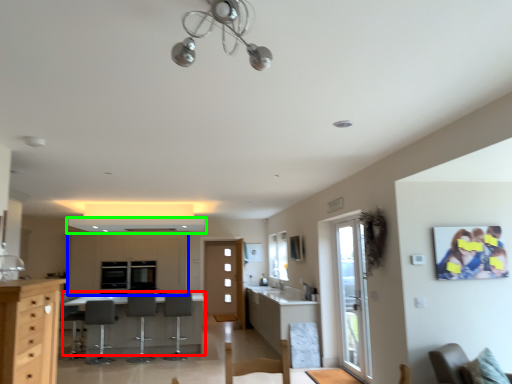
Question: Which object is the closest to the table (highlighted by a red box)? Choose among these: cabinetry (highlighted by a blue box) or exhaust hood (highlighted by a green box).

Choices:
 (A) cabinetry
 (B) exhaust hood

Answer: (A)